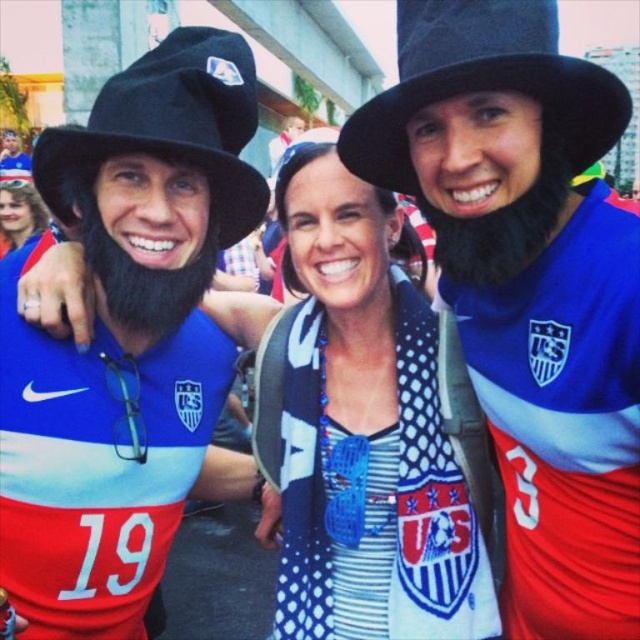
You are a photographer trying to capture a clear shot of the white dotted scarf at center and the matte black hat at upper left. Which object is positioned higher in the frame?

The matte black hat at upper left is located above the white dotted scarf at center, so it is positioned higher in the frame.

You are a photographer at a sports event. You need to decide which hat to adjust first because it is smaller and might not be visible in the group photo. Which one should you adjust, the black felt hat at upper center or the black fabric hat at left?

The black felt hat at upper center has a smaller size compared to the black fabric hat at left, so you should adjust the black felt hat at upper center first to ensure visibility in the group photo.